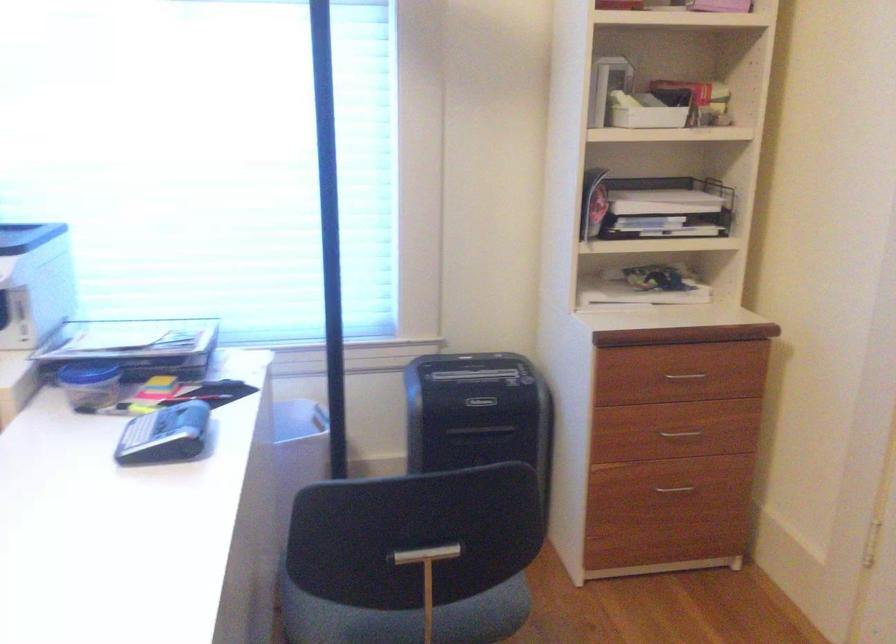
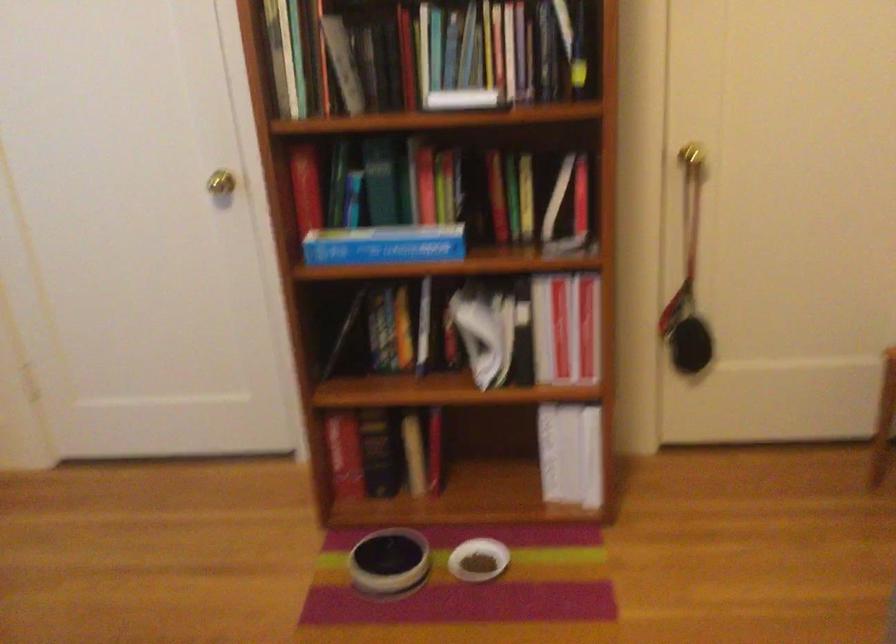
Consider the image. First-person continuous shooting, in which direction is the camera rotating?

The camera's rotation is toward right-down.